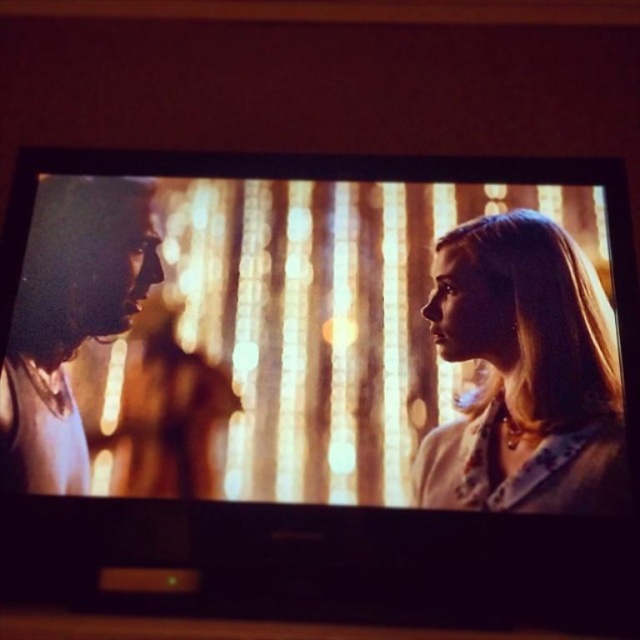
You are watching a TV show and notice two people on the screen. The scene shows a person with smooth blonde hair at left and another with blonde hair at right. Based on their positions, which person is standing farther to the right side of the TV screen?

The person with blonde hair at right is standing farther to the right side of the TV screen because the blonde hair at right is positioned to the right of the smooth blonde hair at left.

Looking at this image, you are sitting on the couch in front of the TV and want to know which person has their hair closer to you. The TV shows two people with blonde hair at right and smooth blonde hair at left. Which one is closer to you?

The blonde hair at right is closer to the viewer than the smooth blonde hair at left, so the person with blonde hair at right is closer to you.